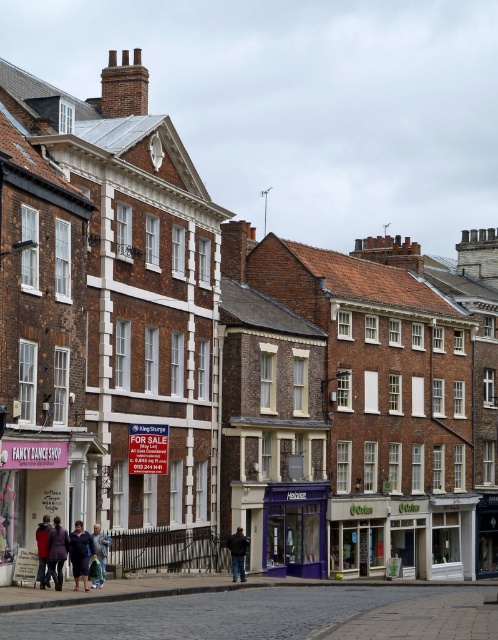
Question: Considering the relative positions of pink fabric sign at center and purple glass storefront at center in the image provided, where is pink fabric sign at center located with respect to purple glass storefront at center?

Choices:
 (A) below
 (B) above

Answer: (B)

Question: Can you confirm if pink fabric sign at center is positioned above black leather jacket at center?

Choices:
 (A) no
 (B) yes

Answer: (B)

Question: Which of these objects is positioned farthest from the dark blue jacket at center?

Choices:
 (A) dark brown leather coat at center
 (B) pink fabric sign at center
 (C) purple glass storefront at center

Answer: (C)

Question: Does pink fabric sign at center have a smaller size compared to dark brown leather coat at center?

Choices:
 (A) yes
 (B) no

Answer: (B)

Question: Considering the real-world distances, which object is farthest from the purple glass storefront at center?

Choices:
 (A) dark blue jacket at center
 (B) dark blue jacket at lower left
 (C) black leather jacket at center

Answer: (B)

Question: Which is farther from the dark blue jacket at center?

Choices:
 (A) black leather jacket at center
 (B) dark brown leather coat at center
 (C) pink fabric sign at center
 (D) purple glass storefront at center

Answer: (D)